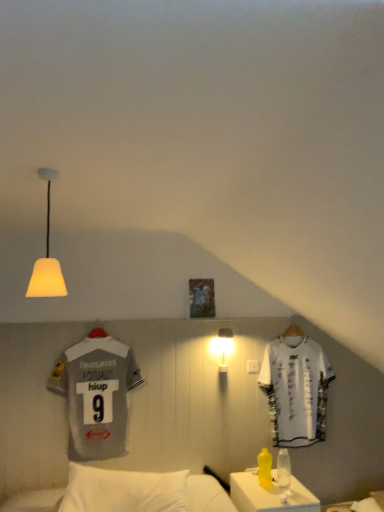
Question: Considering the relative sizes of yellow translucent bottle at lower right, the second bottle positioned from the left, and yellow matte bottle at lower right, acting as the second bottle starting from the right, in the image provided, is yellow translucent bottle at lower right, the second bottle positioned from the left, thinner than yellow matte bottle at lower right, acting as the second bottle starting from the right,?

Choices:
 (A) no
 (B) yes

Answer: (B)

Question: Is yellow translucent bottle at lower right, the 1th bottle viewed from the right, smaller than yellow matte bottle at lower right, which is counted as the 1th bottle, starting from the left?

Choices:
 (A) no
 (B) yes

Answer: (B)

Question: Is yellow translucent bottle at lower right, the 1th bottle viewed from the right, behind yellow matte bottle at lower right, acting as the second bottle starting from the right?

Choices:
 (A) no
 (B) yes

Answer: (A)

Question: From the image's perspective, is yellow translucent bottle at lower right, the second bottle positioned from the left, below yellow matte bottle at lower right, acting as the second bottle starting from the right?

Choices:
 (A) no
 (B) yes

Answer: (A)

Question: From a real-world perspective, is yellow translucent bottle at lower right, the 1th bottle viewed from the right, physically below yellow matte bottle at lower right, which is counted as the 1th bottle, starting from the left?

Choices:
 (A) yes
 (B) no

Answer: (B)

Question: From a real-world perspective, is yellow translucent bottle at lower right, the second bottle positioned from the left, over yellow matte bottle at lower right, acting as the second bottle starting from the right?

Choices:
 (A) no
 (B) yes

Answer: (B)

Question: Considering the relative positions of white frosted glass wall lamp at center, which is the 2th lamp in top-to-bottom order, and yellow matte bottle at lower right, acting as the second bottle starting from the right, in the image provided, is white frosted glass wall lamp at center, which is the 2th lamp in top-to-bottom order, to the right of yellow matte bottle at lower right, acting as the second bottle starting from the right, from the viewer's perspective?

Choices:
 (A) yes
 (B) no

Answer: (B)

Question: Can you confirm if white frosted glass wall lamp at center, the 1th lamp when ordered from bottom to top, is thinner than yellow matte bottle at lower right, acting as the second bottle starting from the right?

Choices:
 (A) yes
 (B) no

Answer: (B)

Question: Is white frosted glass wall lamp at center, the second lamp when ordered from front to back, taller than yellow matte bottle at lower right, which is counted as the 1th bottle, starting from the left?

Choices:
 (A) yes
 (B) no

Answer: (A)

Question: From the image's perspective, is white frosted glass wall lamp at center, the first lamp when ordered from back to front, above yellow matte bottle at lower right, acting as the second bottle starting from the right?

Choices:
 (A) no
 (B) yes

Answer: (B)

Question: Does white frosted glass wall lamp at center, the 2th lamp from the left, have a greater width compared to yellow matte bottle at lower right, acting as the second bottle starting from the right?

Choices:
 (A) yes
 (B) no

Answer: (A)

Question: Does white frosted glass wall lamp at center, the 2th lamp from the left, appear on the left side of yellow matte bottle at lower right, which is counted as the 1th bottle, starting from the left?

Choices:
 (A) yes
 (B) no

Answer: (A)

Question: Is white plastic table at lower right surrounding gray jersey at left, marked as the first sports uniform in a front-to-back arrangement?

Choices:
 (A) yes
 (B) no

Answer: (B)